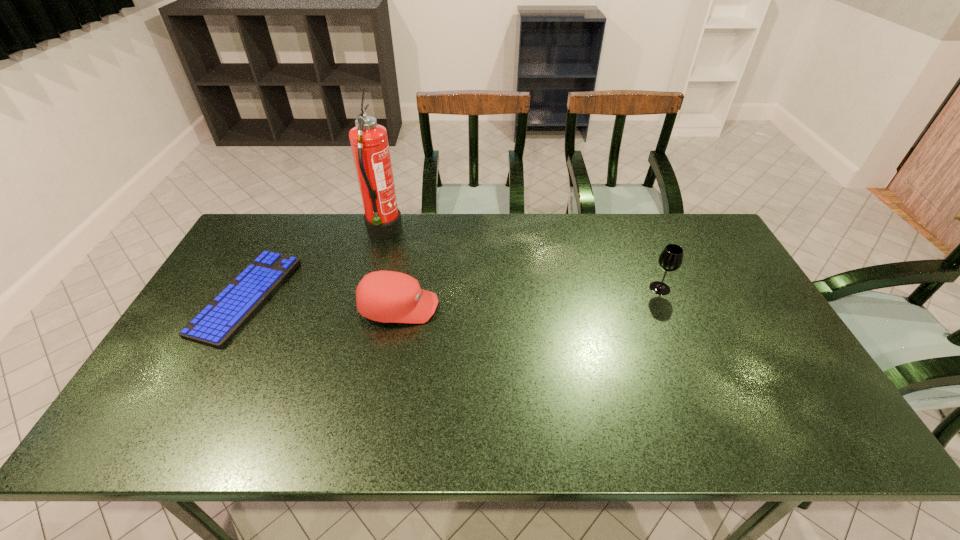
What are the coordinates of `fire extinguisher` in the screenshot? It's located at (369, 142).

Locate an element on the screen. The height and width of the screenshot is (540, 960). the farthest object is located at coordinates (369, 142).

This screenshot has width=960, height=540. I want to click on the rightmost object, so click(x=670, y=259).

Where is `the third shortest object`? The width and height of the screenshot is (960, 540). the third shortest object is located at coordinates (670, 259).

Find the location of a particular element. The image size is (960, 540). cap is located at coordinates (385, 296).

Locate an element on the screen. the shortest object is located at coordinates (217, 323).

This screenshot has width=960, height=540. In order to click on the leftmost object in this screenshot , I will do `click(217, 323)`.

Locate an element on the screen. vacant space located 0.120m on the front-facing side of the farthest object is located at coordinates (437, 233).

Identify the location of free spot located 0.170m on the back of the wineglass. (642, 246).

At what (x,y) coordinates should I click in order to perform the action: click on vacant space located 0.240m on the front-facing side of the cap. Please return your answer as a coordinate pair (x, y). The height and width of the screenshot is (540, 960). Looking at the image, I should click on (523, 307).